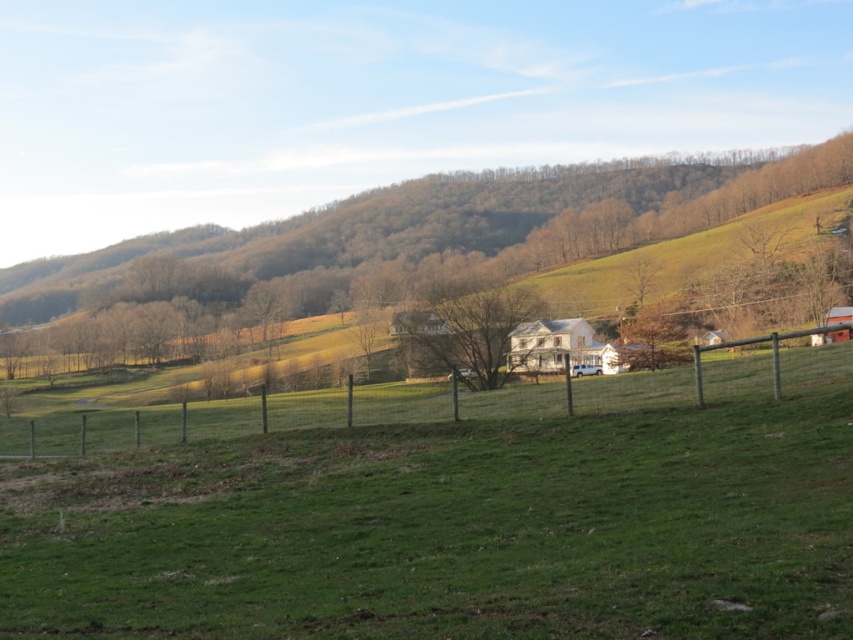
You are a gardener who wants to plant new flowers in the green grassy field at center. Since the bare branches at center are nearby, will the flowers be taller than the branches when they grow?

The green grassy field at center is not as tall as the bare branches at center, so the flowers planted there will not grow taller than the branches.

You are a gardener standing at the wooden fence at lower center and want to reach the bare branches at center to prune them. Given that your longest pruning tool can extend up to 8 meters, will you be able to reach the branches without moving closer?

The distance between the wooden fence at lower center and the bare branches at center is 9.43 meters. Since your pruning tool can only extend up to 8 meters, you will need to move closer to reach the branches.